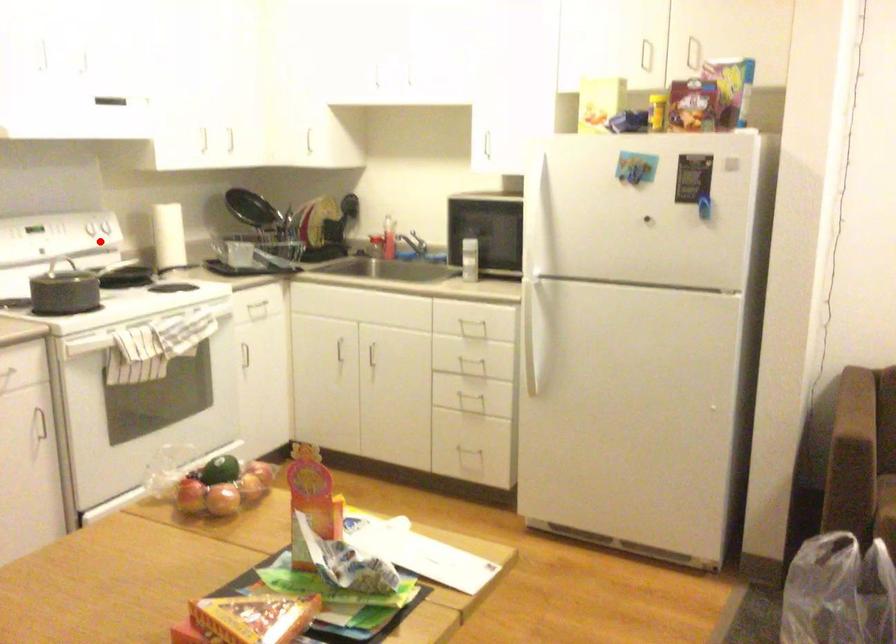
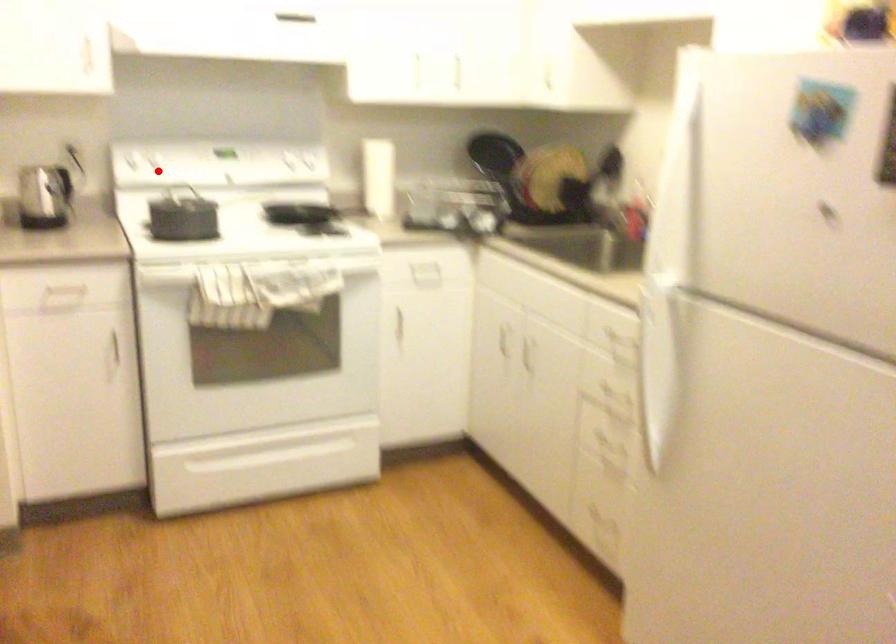
I am providing you with two images of the same scene from different viewpoints. A red point is marked on the first image and another point is marked on the second image. Are the points marked in image1 and image2 representing the same 3D position?

No